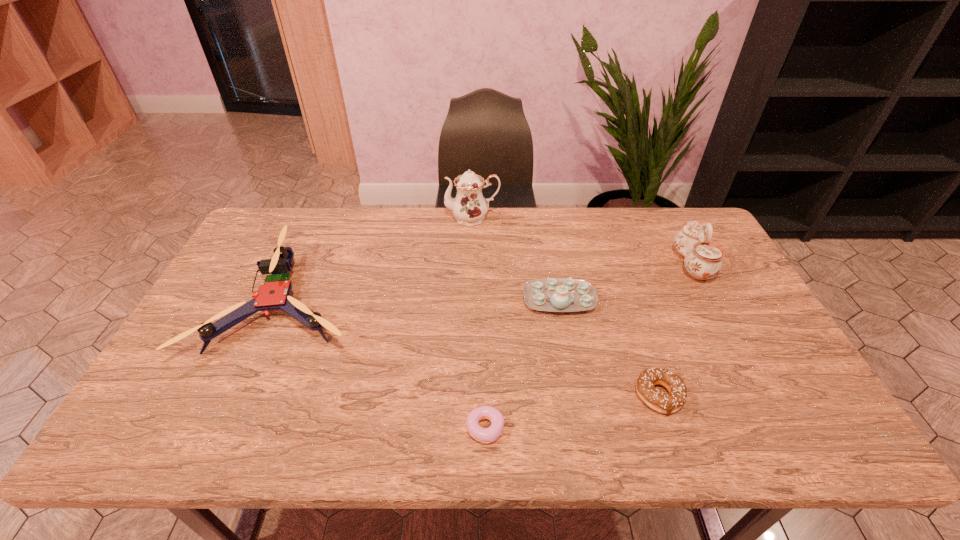
At what (x,y) coordinates should I click in order to perform the action: click on the farthest object. Please return your answer as a coordinate pair (x, y). Looking at the image, I should click on (469, 207).

In order to click on the leftmost chinaware in this screenshot , I will do `click(469, 207)`.

Where is `the second shortest chinaware`? the second shortest chinaware is located at coordinates (702, 260).

What are the coordinates of `the rightmost chinaware` in the screenshot? It's located at (702, 260).

The width and height of the screenshot is (960, 540). Find the location of `the leftmost object`. the leftmost object is located at coordinates (274, 293).

Locate an element on the screen. the third shortest object is located at coordinates (549, 294).

I want to click on the fourth object from left to right, so click(x=549, y=294).

Identify the location of the fifth object from left to right. coord(657,400).

Where is `the right doughnut`? the right doughnut is located at coordinates (657, 400).

The width and height of the screenshot is (960, 540). What are the coordinates of `the left doughnut` in the screenshot? It's located at (488, 435).